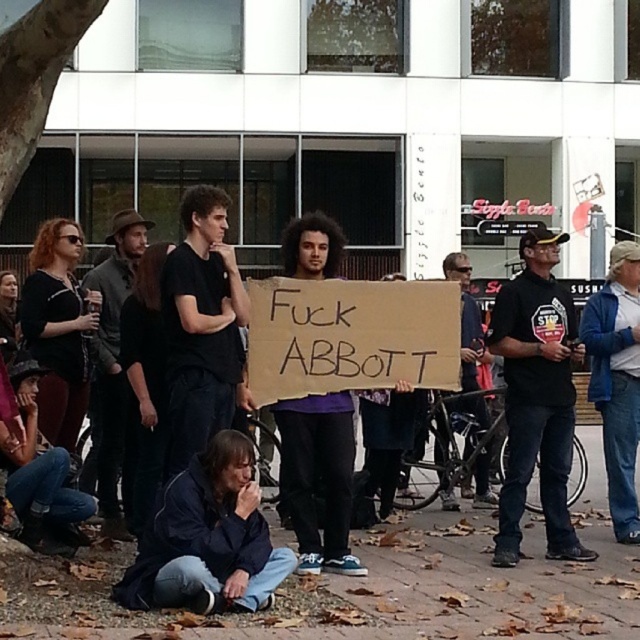
Question: Estimate the real-world distances between objects in this image. Which object is closer to the dark blue shirt at left?

Choices:
 (A) matte black t-shirt at center
 (B) cardboard sign at center
 (C) black t-shirt at center
 (D) black matte shirt at center

Answer: (D)

Question: Can you confirm if black t-shirt at center is wider than dark blue shirt at left?

Choices:
 (A) yes
 (B) no

Answer: (A)

Question: Estimate the real-world distances between objects in this image. Which object is closer to the dark blue shirt at left?

Choices:
 (A) black matte shirt at center
 (B) matte black t-shirt at center
 (C) cardboard sign at center

Answer: (A)

Question: Is black t-shirt at center to the right of matte black t-shirt at center from the viewer's perspective?

Choices:
 (A) no
 (B) yes

Answer: (B)

Question: Is cardboard sign at center above dark blue shirt at left?

Choices:
 (A) yes
 (B) no

Answer: (B)

Question: Which point is farther to the camera?

Choices:
 (A) (467, 358)
 (B) (129, 216)
 (C) (19, 561)

Answer: (A)